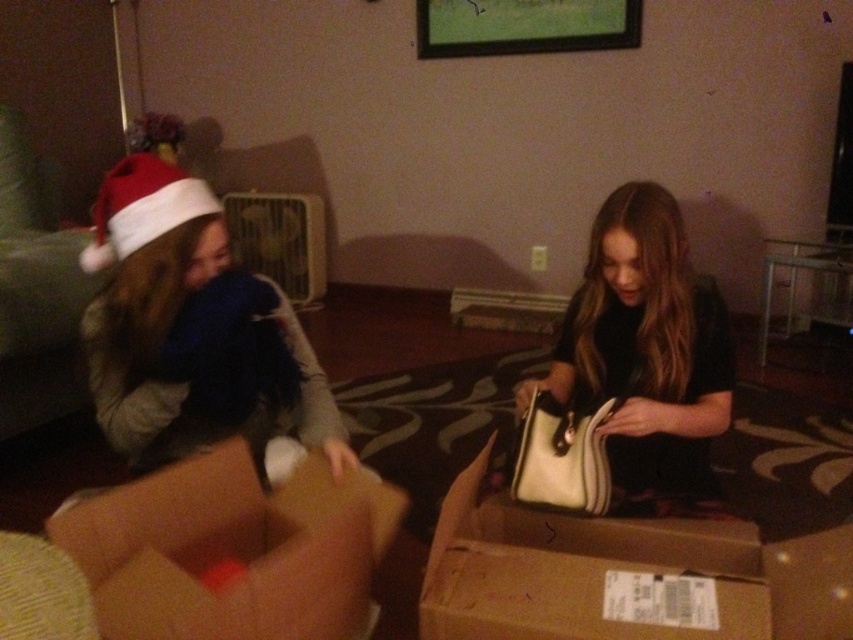
From the picture: You are a photographer setting up a shoot in the living room. You need to place a small prop between the matte white plush at left and the red velvet santa hat at upper left. Which object should the prop be closer to if you want it to appear larger in the final photo?

The prop should be placed closer to the matte white plush at left because objects closer to the viewer appear larger in the photo.